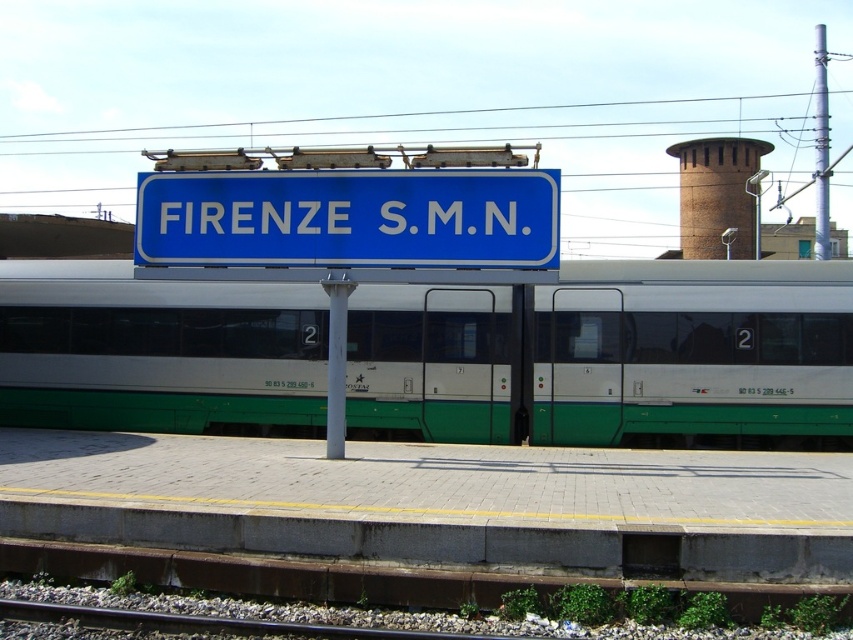
You are a passenger standing on the platform at the FIRENZE S.M.N. station. You see the green metallic train at center and the blue plastic sign at center. Which object is closer to you?

The green metallic train at center is closer to you than the blue plastic sign at center.

You are a station attendant who needs to guide a visually impaired passenger to the blue plastic sign at center. The passenger is currently standing near the green metallic train at center. Which direction should they move to reach the sign?

The blue plastic sign at center is smaller than the green metallic train at center, so the passenger should move towards the smaller object to reach the blue plastic sign at center.